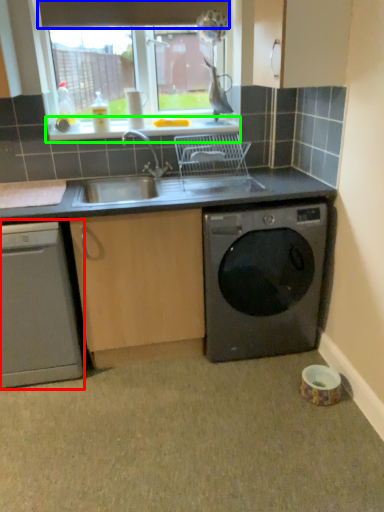
Question: Considering the real-world distances, which object is closest to dishwasher (highlighted by a red box)? exhaust hood (highlighted by a blue box) or window sill (highlighted by a green box).

Choices:
 (A) exhaust hood
 (B) window sill

Answer: (B)